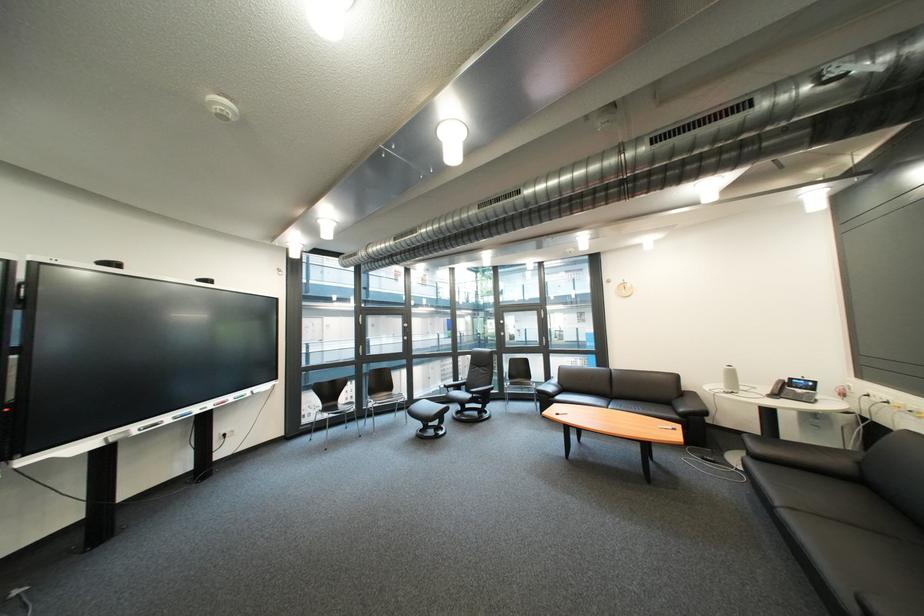
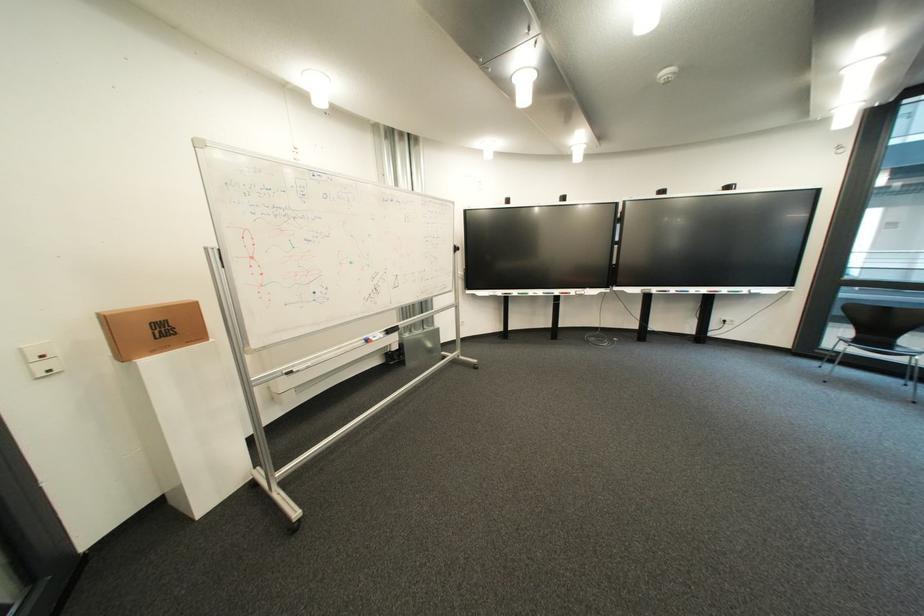
The point at (338, 411) is marked in the first image. Where is the corresponding point in the second image?

(870, 342)